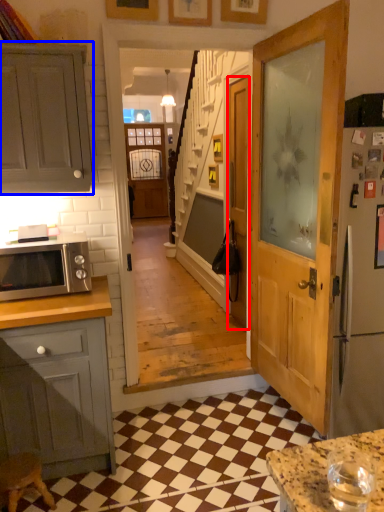
Question: Which point is further to the camera, door (highlighted by a red box) or cabinetry (highlighted by a blue box)?

Choices:
 (A) door
 (B) cabinetry

Answer: (A)